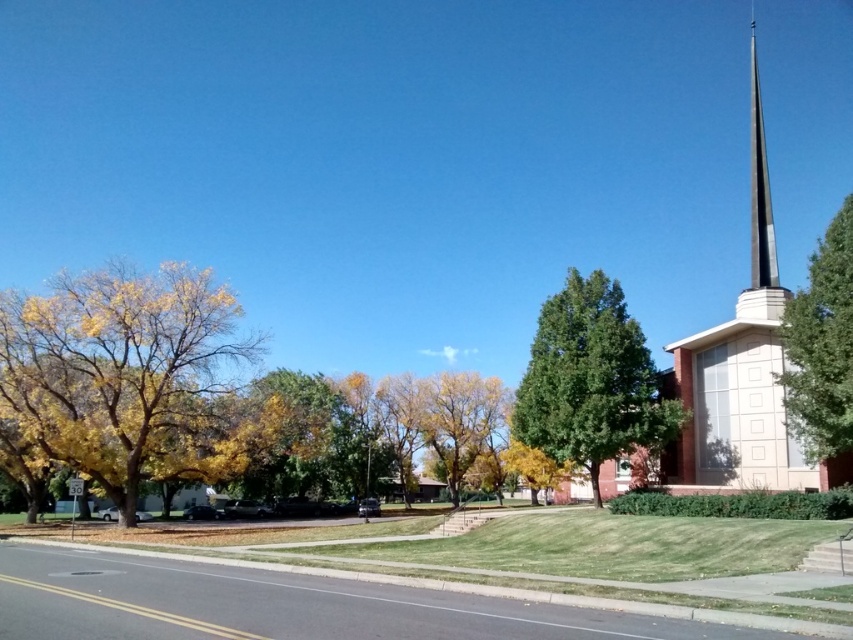
Between green leafy tree at center and yellow-green leaves at center, which one has less height?

green leafy tree at center is shorter.

Describe the element at coordinates (590, 380) in the screenshot. I see `green leafy tree at center` at that location.

Where is `green leafy tree at center`? The height and width of the screenshot is (640, 853). green leafy tree at center is located at coordinates (590, 380).

In the scene shown: Between yellow leafy tree at left and green leafy tree at upper right, which one is positioned lower?

yellow leafy tree at left

Can you confirm if yellow leafy tree at left is smaller than green leafy tree at upper right?

Yes, yellow leafy tree at left is smaller than green leafy tree at upper right.

Which is in front, point (165, 406) or point (827, 310)?

Positioned in front is point (827, 310).

This screenshot has height=640, width=853. I want to click on yellow leafy tree at left, so click(x=122, y=371).

Is yellow-green leaves at center further to the viewer compared to yellow leafy tree at center?

Yes, yellow-green leaves at center is further from the viewer.

Is yellow-green leaves at center smaller than yellow leafy tree at center?

Correct, yellow-green leaves at center occupies less space than yellow leafy tree at center.

You are a GUI agent. You are given a task and a screenshot of the screen. Output one action in this format:
    pyautogui.click(x=<x>, y=<y>)
    Task: Click on the yellow-green leaves at center
    Image resolution: width=853 pixels, height=640 pixels.
    Given the screenshot: What is the action you would take?
    pyautogui.click(x=460, y=420)

Where is `yellow-green leaves at center`? This screenshot has height=640, width=853. yellow-green leaves at center is located at coordinates (460, 420).